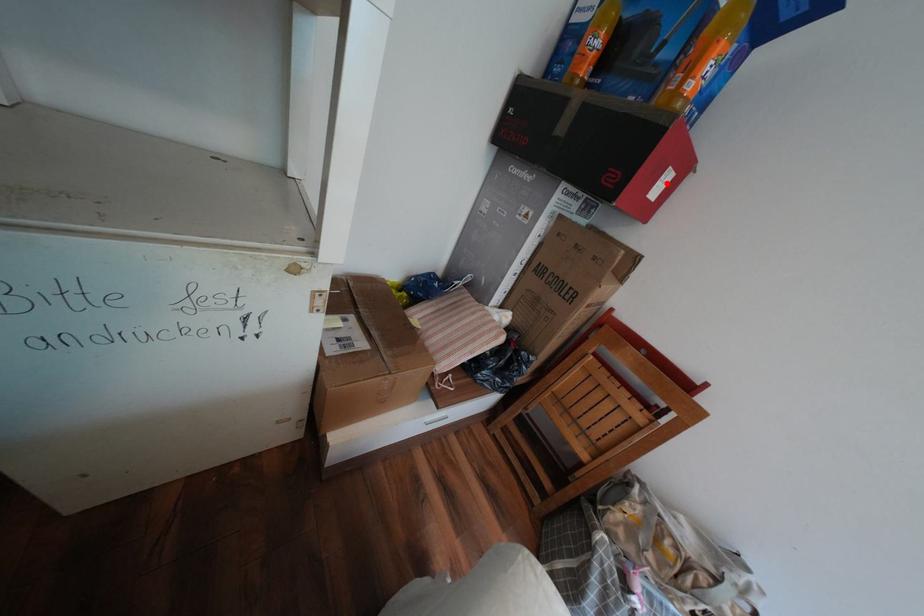
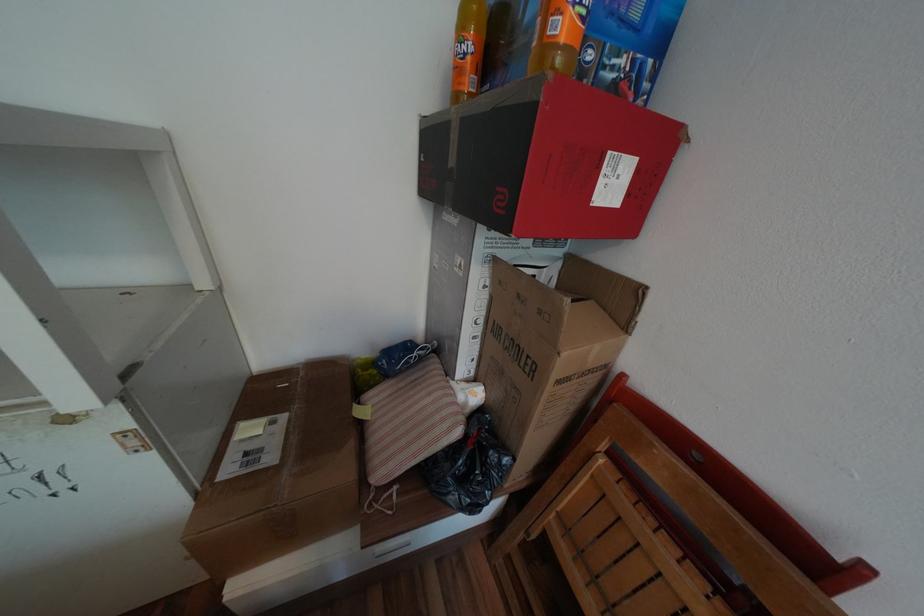
In the second image, find the point that corresponds to the highlighted location in the first image.

(611, 182)